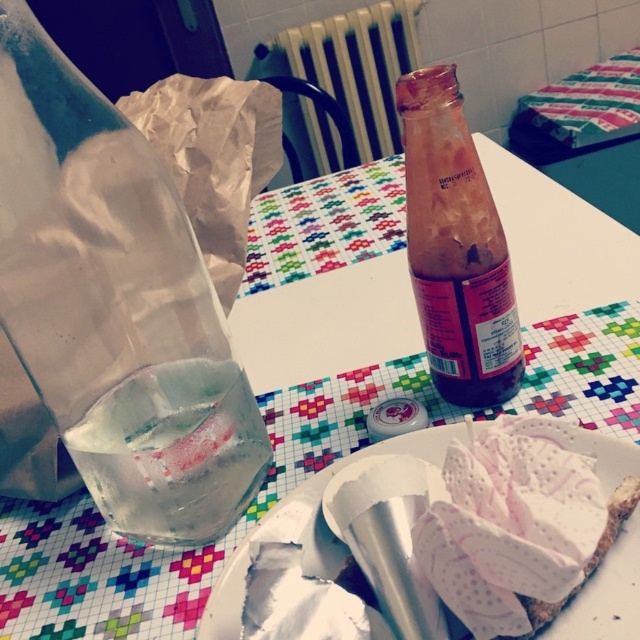
Question: Can you confirm if transparent plastic bottle at left is positioned above clear glass bottle at left?

Choices:
 (A) yes
 (B) no

Answer: (A)

Question: Which of the following is the farthest from the observer?

Choices:
 (A) (x=26, y=273)
 (B) (x=573, y=609)
 (C) (x=227, y=362)
 (D) (x=268, y=58)

Answer: (D)

Question: Which object appears closest to the camera in this image?

Choices:
 (A) transparent plastic bottle at left
 (B) metallic radiator at upper center
 (C) white paper plate at lower right
 (D) translucent glass bottle at center

Answer: (C)

Question: Which point is closer to the camera taking this photo?

Choices:
 (A) (420, 442)
 (B) (246, 435)
 (C) (316, 51)
 (D) (104, 125)

Answer: (D)

Question: Is clear glass bottle at left above metallic radiator at upper center?

Choices:
 (A) yes
 (B) no

Answer: (B)

Question: Does clear glass bottle at left lie behind metallic radiator at upper center?

Choices:
 (A) no
 (B) yes

Answer: (A)